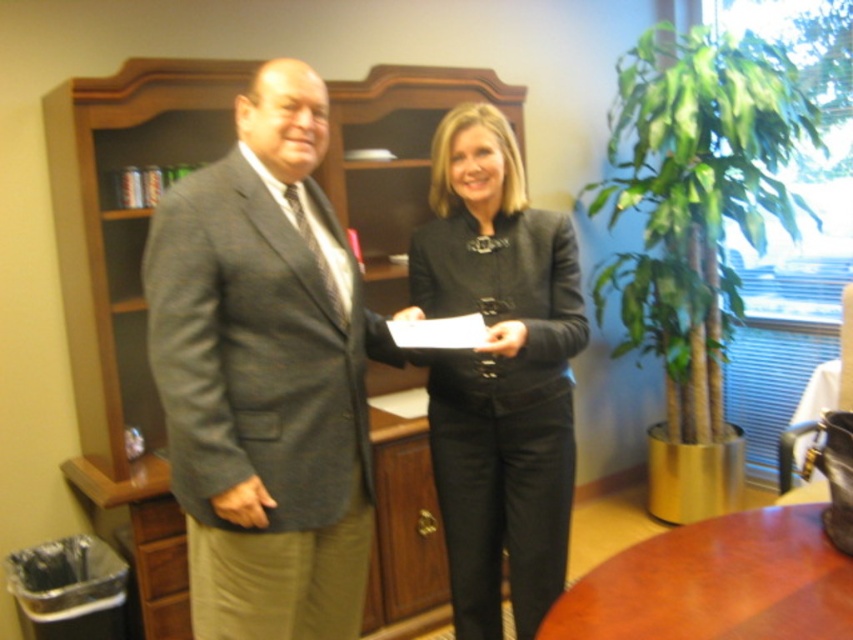
Question: Is gray wool suit at center to the left of black matte blazer at center from the viewer's perspective?

Choices:
 (A) yes
 (B) no

Answer: (A)

Question: Which is farther from the black matte blazer at center?

Choices:
 (A) brown wooden table at center
 (B) gray wool suit at center

Answer: (A)

Question: Among these objects, which one is nearest to the camera?

Choices:
 (A) black matte blazer at center
 (B) gray wool suit at center

Answer: (B)

Question: Which object is farther from the camera taking this photo?

Choices:
 (A) brown wooden table at center
 (B) black matte blazer at center

Answer: (B)

Question: Is gray wool suit at center smaller than black matte blazer at center?

Choices:
 (A) no
 (B) yes

Answer: (A)

Question: Can you confirm if gray wool suit at center is thinner than brown wooden table at center?

Choices:
 (A) yes
 (B) no

Answer: (A)